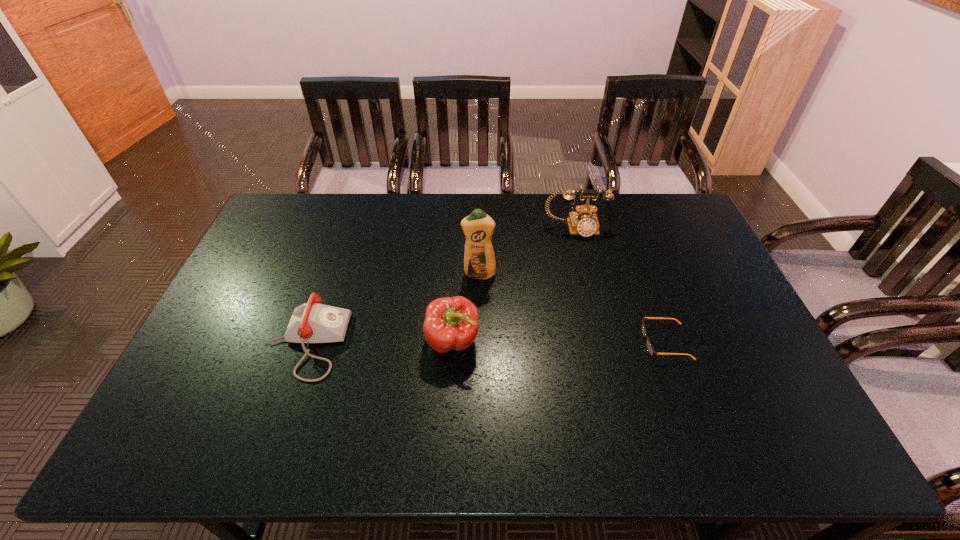
Image resolution: width=960 pixels, height=540 pixels. I want to click on free space located on the back of the pepper, so click(456, 288).

Identify the location of free spot located on the dial of the left telephone. [443, 343].

Find the location of `free space located on the front-facing side of the shortest object`. free space located on the front-facing side of the shortest object is located at coordinates (566, 342).

Where is `vacant space located 0.070m on the front-facing side of the shortest object`? The width and height of the screenshot is (960, 540). vacant space located 0.070m on the front-facing side of the shortest object is located at coordinates (617, 342).

Identify the location of vacant area situated on the front-facing side of the shortest object. (530, 342).

You are a GUI agent. You are given a task and a screenshot of the screen. Output one action in this format:
    pyautogui.click(x=<x>, y=<y>)
    Task: Click on the object at the far edge
    The height and width of the screenshot is (540, 960).
    Given the screenshot: What is the action you would take?
    pyautogui.click(x=583, y=221)

Where is `vacant area at the far edge`? Image resolution: width=960 pixels, height=540 pixels. vacant area at the far edge is located at coordinates pos(547,225).

What are the coordinates of `vacant space at the left edge of the desktop` in the screenshot? It's located at (277, 245).

At what (x,y) coordinates should I click in order to perform the action: click on vacant space at the right edge. Please return your answer as a coordinate pair (x, y). This screenshot has height=540, width=960. Looking at the image, I should click on (661, 235).

The image size is (960, 540). In order to click on vacant region at the near left corner of the desktop in this screenshot , I will do click(x=191, y=429).